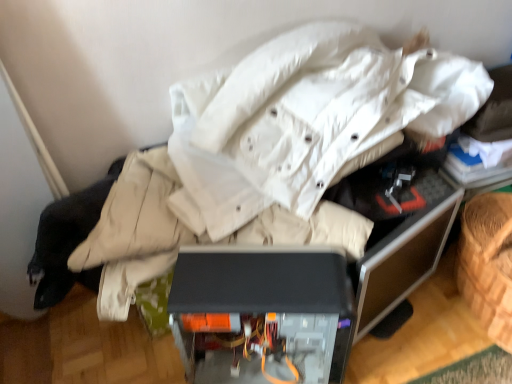
Describe the element at coordinates (262, 314) in the screenshot. I see `transparent plastic case at center` at that location.

Image resolution: width=512 pixels, height=384 pixels. What are the coordinates of `transparent plastic case at center` in the screenshot? It's located at (262, 314).

At what (x,y) coordinates should I click in order to perform the action: click on matte black computer case at center. Please return your answer as a coordinate pair (x, y). Looking at the image, I should click on (313, 278).

This screenshot has height=384, width=512. Describe the element at coordinates (313, 278) in the screenshot. I see `matte black computer case at center` at that location.

Measure the distance between matte black computer case at center and camera.

The distance of matte black computer case at center from camera is 32.79 inches.

Identify the location of transparent plastic case at center. (262, 314).

Which is more to the right, transparent plastic case at center or matte black computer case at center?

Positioned to the right is transparent plastic case at center.

Who is more distant, transparent plastic case at center or matte black computer case at center?

transparent plastic case at center is further away from the camera.

Does point (241, 302) come closer to viewer compared to point (426, 170)?

That is True.

From the image's perspective, which is below, transparent plastic case at center or matte black computer case at center?

matte black computer case at center.

From a real-world perspective, is transparent plastic case at center located beneath matte black computer case at center?

No.

Is transparent plastic case at center thinner than matte black computer case at center?

Yes.

Considering the relative sizes of transparent plastic case at center and matte black computer case at center in the image provided, is transparent plastic case at center shorter than matte black computer case at center?

No, transparent plastic case at center is not shorter than matte black computer case at center.

Based on their sizes in the image, would you say transparent plastic case at center is bigger or smaller than matte black computer case at center?

Clearly, transparent plastic case at center is smaller in size than matte black computer case at center.

Is transparent plastic case at center not inside matte black computer case at center?

That's correct, transparent plastic case at center is outside of matte black computer case at center.

Based on the photo, is transparent plastic case at center next to matte black computer case at center?

Indeed, transparent plastic case at center and matte black computer case at center are beside each other and touching.

Is transparent plastic case at center turned away from matte black computer case at center?

transparent plastic case at center is not turned away from matte black computer case at center.

Find the location of a particular element. The image size is (512, 384). furniture above the matte black computer case at center (from the image's perspective) is located at coordinates (262, 314).

Would you say matte black computer case at center is to the left or to the right of transparent plastic case at center in the picture?

matte black computer case at center is positioned on transparent plastic case at center's left side.

Is the position of matte black computer case at center more distant than that of transparent plastic case at center?

No, matte black computer case at center is closer to the camera.

Which is in front, point (338, 340) or point (339, 338)?

The point (339, 338) is more forward.

From the image's perspective, which one is positioned higher, matte black computer case at center or transparent plastic case at center?

transparent plastic case at center, from the image's perspective.

From a real-world perspective, between matte black computer case at center and transparent plastic case at center, who is vertically higher?

In real-world perspective, transparent plastic case at center is above.

Looking at their sizes, would you say matte black computer case at center is wider or thinner than transparent plastic case at center?

In the image, matte black computer case at center appears to be wider than transparent plastic case at center.

Considering the sizes of objects matte black computer case at center and transparent plastic case at center in the image provided, who is shorter, matte black computer case at center or transparent plastic case at center?

matte black computer case at center.

Is matte black computer case at center smaller than transparent plastic case at center?

Incorrect, matte black computer case at center is not smaller in size than transparent plastic case at center.

Would you say matte black computer case at center contains transparent plastic case at center?

No, transparent plastic case at center is not a part of matte black computer case at center.

Are matte black computer case at center and transparent plastic case at center located far from each other?

They are positioned close to each other.

Is matte black computer case at center facing away from transparent plastic case at center?

Yes, transparent plastic case at center is at the back of matte black computer case at center.

How different are the orientations of matte black computer case at center and transparent plastic case at center in degrees?

The facing directions of matte black computer case at center and transparent plastic case at center are 19.4 degrees apart.

I want to click on computer desk in front of the transparent plastic case at center, so click(x=313, y=278).

Locate an element on the screen. computer desk on the left of transparent plastic case at center is located at coordinates (313, 278).

Image resolution: width=512 pixels, height=384 pixels. Identify the location of computer desk below the transparent plastic case at center (from a real-world perspective). (313, 278).